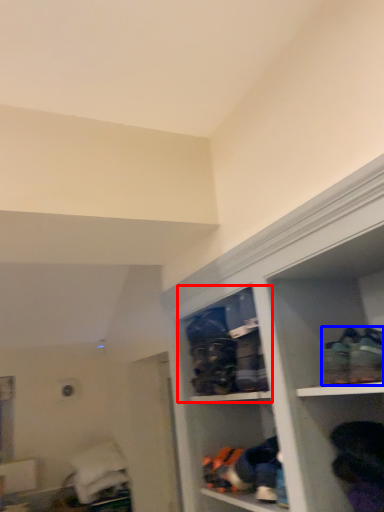
Question: Among these objects, which one is farthest to the camera, cabinet (highlighted by a red box) or footwear (highlighted by a blue box)?

Choices:
 (A) cabinet
 (B) footwear

Answer: (A)